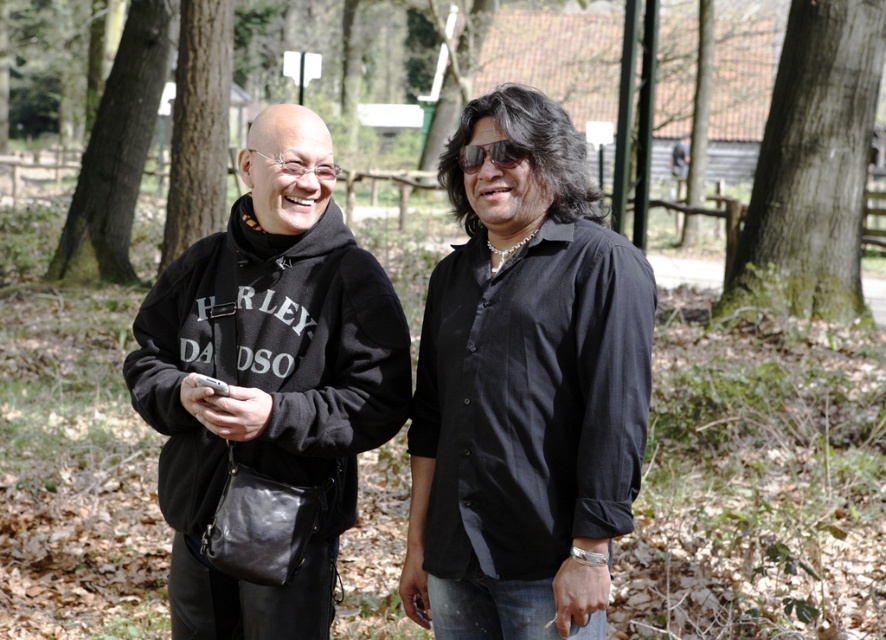
Does point (363, 74) lie behind point (224, 58)?

Yes, it is.

Is point (25, 58) farther from viewer compared to point (176, 109)?

That is True.

The height and width of the screenshot is (640, 886). Identify the location of brown bark tree at center. (45, 68).

What do you see at coordinates (525, 390) in the screenshot? Image resolution: width=886 pixels, height=640 pixels. I see `black satin shirt at center` at bounding box center [525, 390].

You are a GUI agent. You are given a task and a screenshot of the screen. Output one action in this format:
    pyautogui.click(x=<x>, y=<y>)
    Task: Click on the black satin shirt at center
    This screenshot has height=640, width=886.
    Given the screenshot: What is the action you would take?
    pyautogui.click(x=525, y=390)

What do you see at coordinates (525, 390) in the screenshot? Image resolution: width=886 pixels, height=640 pixels. I see `black satin shirt at center` at bounding box center [525, 390].

At what (x,y) coordinates should I click in order to perform the action: click on black satin shirt at center. Please return your answer as a coordinate pair (x, y). Looking at the image, I should click on (525, 390).

Does green mossy bark tree at right have a larger size compared to brown rough bark tree at left?

Yes.

Is green mossy bark tree at right behind brown rough bark tree at left?

No, it is not.

At what (x,y) coordinates should I click in order to perform the action: click on green mossy bark tree at right. Please return your answer as a coordinate pair (x, y). The image size is (886, 640). Looking at the image, I should click on (812, 164).